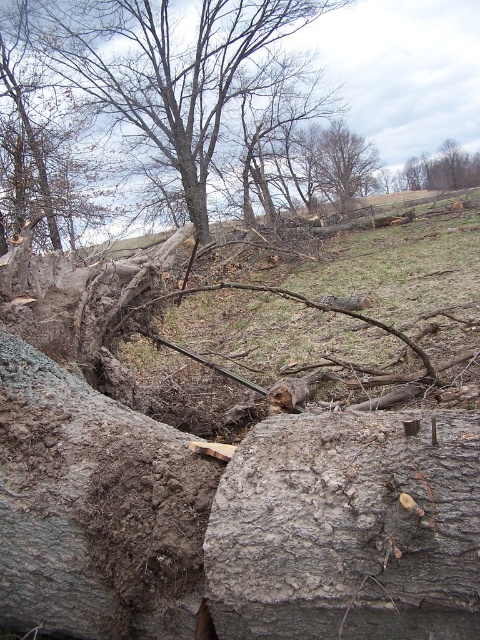
You are a hiker who just arrived at the scene. You see the gray rough log at center and the smooth bark tree at upper right. Which object is closer to you?

The gray rough log at center is closer to you because it is in front of the smooth bark tree at upper right.

You are standing at the point labeled point (350, 168). You want to take a photo of the uprooted tree from a distance of exactly 100 feet. How much farther do you need to walk away from the current position?

The point labeled point (350, 168) is currently 90.69 feet away from the camera. To reach a distance of 100 feet, you need to walk an additional 9.31 feet away from the current position.